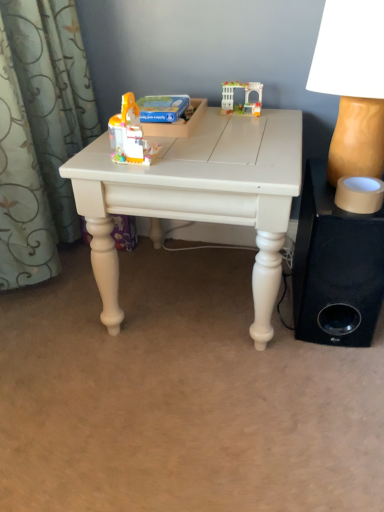
At what (x,y) coordinates should I click in order to perform the action: click on vacant space in front of translucent plastic toy at center, the 1th toy in the bottom-to-top sequence. Please return your answer as a coordinate pair (x, y). Looking at the image, I should click on (137, 169).